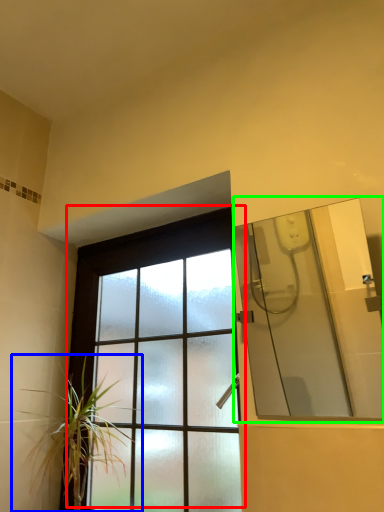
Question: Which object is positioned farthest from window (highlighted by a red box)? Select from houseplant (highlighted by a blue box) and mirror (highlighted by a green box).

Choices:
 (A) houseplant
 (B) mirror

Answer: (B)